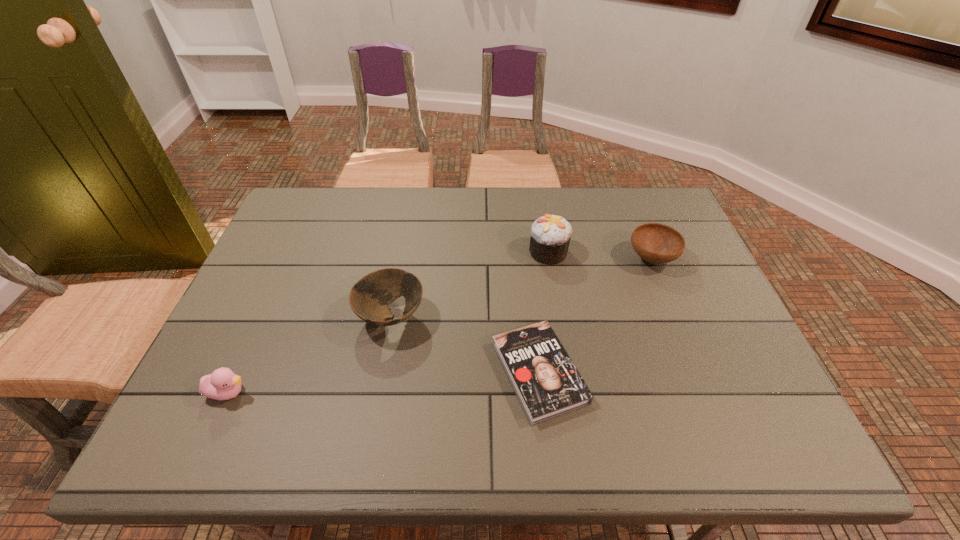
In order to click on free space between the right bowl and the cupcake in this screenshot , I will do tap(600, 255).

Locate an element on the screen. The width and height of the screenshot is (960, 540). empty space between the nearer bowl and the book is located at coordinates (465, 345).

The height and width of the screenshot is (540, 960). In order to click on vacant space in between the fourth object from right to left and the cupcake in this screenshot , I will do `click(469, 285)`.

You are a GUI agent. You are given a task and a screenshot of the screen. Output one action in this format:
    pyautogui.click(x=<x>, y=<y>)
    Task: Click on the vacant area that lies between the cupcake and the left bowl
    This screenshot has height=540, width=960.
    Given the screenshot: What is the action you would take?
    pyautogui.click(x=469, y=285)

I want to click on vacant area that lies between the shortest object and the leftmost object, so click(x=384, y=382).

Identify the location of vacant area that lies between the book and the leftmost object. 384,382.

This screenshot has width=960, height=540. In order to click on unoccupied position between the book and the rightmost object in this screenshot , I will do `click(595, 316)`.

Locate an element on the screen. free space between the shortest object and the shorter bowl is located at coordinates (595, 316).

What are the coordinates of `vacant region between the duckling and the farther bowl` in the screenshot? It's located at (441, 326).

Image resolution: width=960 pixels, height=540 pixels. What are the coordinates of `object that is the third closest to the nearer bowl` in the screenshot? It's located at (550, 235).